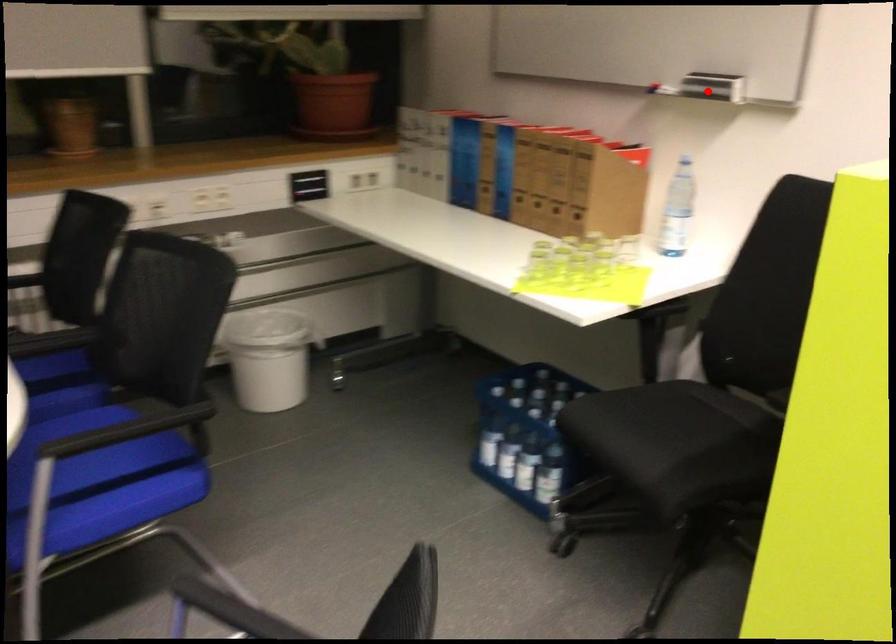
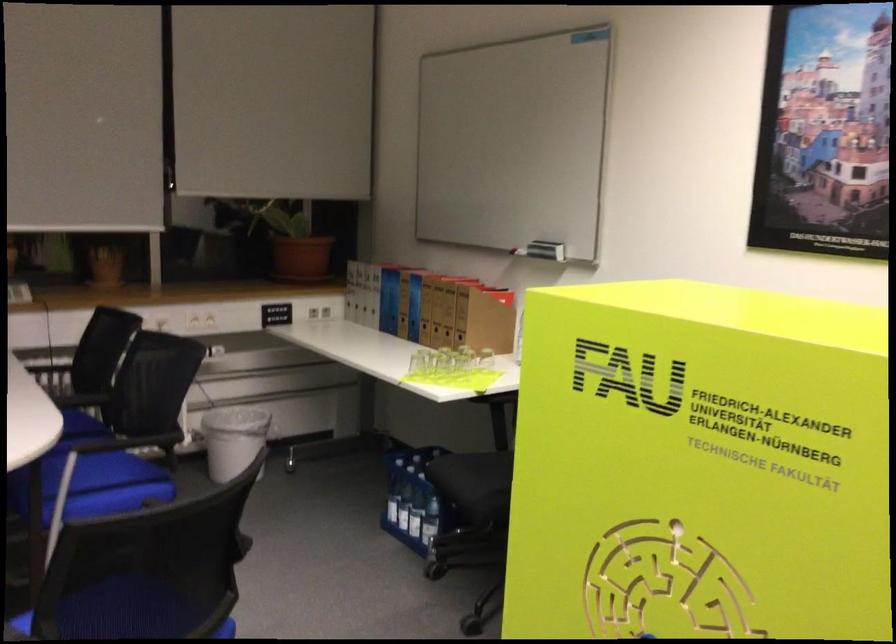
Find the pixel in the second image that matches the highlighted location in the first image.

(546, 250)